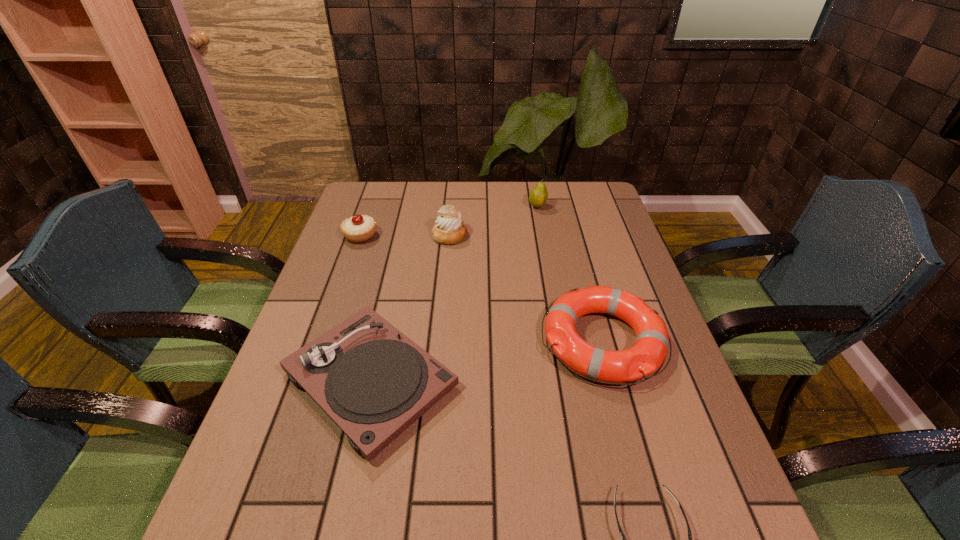
Where is `free spot between the shorter pastry and the right pastry`? This screenshot has width=960, height=540. free spot between the shorter pastry and the right pastry is located at coordinates (405, 235).

Find the location of a particular element. The width and height of the screenshot is (960, 540). blank region between the taller pastry and the life buoy is located at coordinates (526, 288).

The height and width of the screenshot is (540, 960). In order to click on vacant space that is in between the life buoy and the phonograph_record in this screenshot , I will do `click(487, 360)`.

I want to click on free space between the pear and the life buoy, so click(570, 274).

Locate an element on the screen. Image resolution: width=960 pixels, height=540 pixels. vacant region between the pear and the phonograph_record is located at coordinates (454, 293).

You are a GUI agent. You are given a task and a screenshot of the screen. Output one action in this format:
    pyautogui.click(x=<x>, y=<y>)
    Task: Click on the object that is the second closest one to the taller pastry
    
    Given the screenshot: What is the action you would take?
    pyautogui.click(x=538, y=196)

Identify the location of object that stands as the third closest to the pear. This screenshot has height=540, width=960. (358, 228).